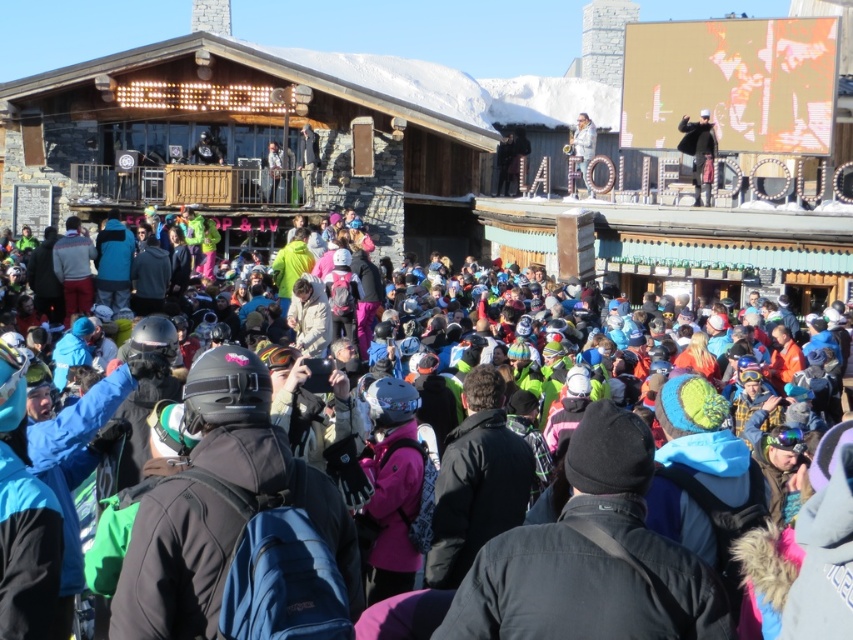
Question: Which point is farther from the camera taking this photo?

Choices:
 (A) (161, 83)
 (B) (691, 154)

Answer: (A)

Question: Is wooden ski resort at center in front of multicolored fabric crowd at center?

Choices:
 (A) no
 (B) yes

Answer: (A)

Question: Is multicolored fabric crowd at center above light brown wooden sign at upper center?

Choices:
 (A) no
 (B) yes

Answer: (A)

Question: Which of the following is the farthest from the observer?

Choices:
 (A) multicolored fabric crowd at center
 (B) black leather jacket at upper right
 (C) light brown wooden sign at upper center

Answer: (C)

Question: Which of the following is the farthest from the observer?

Choices:
 (A) black leather jacket at upper right
 (B) multicolored fabric crowd at center
 (C) light brown wooden sign at upper center
 (D) wooden ski resort at center

Answer: (C)

Question: Is multicolored fabric crowd at center wider than black leather jacket at upper right?

Choices:
 (A) no
 (B) yes

Answer: (B)